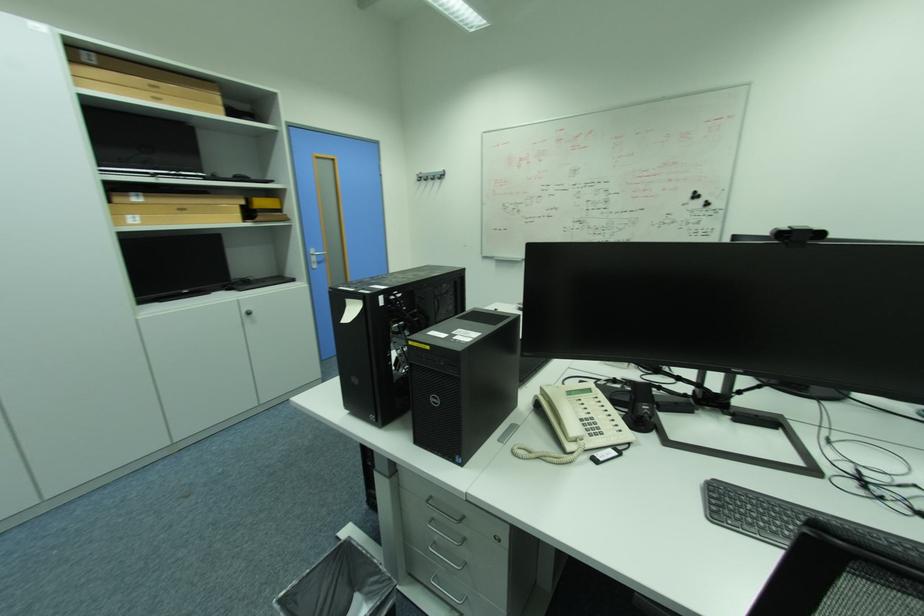
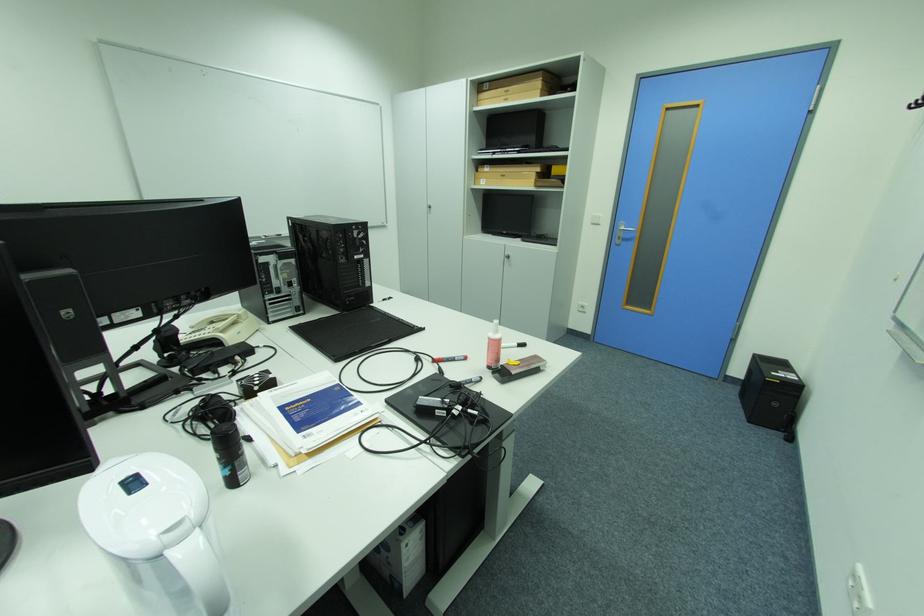
The point at (161, 100) is marked in the first image. Where is the corresponding point in the second image?

(514, 100)